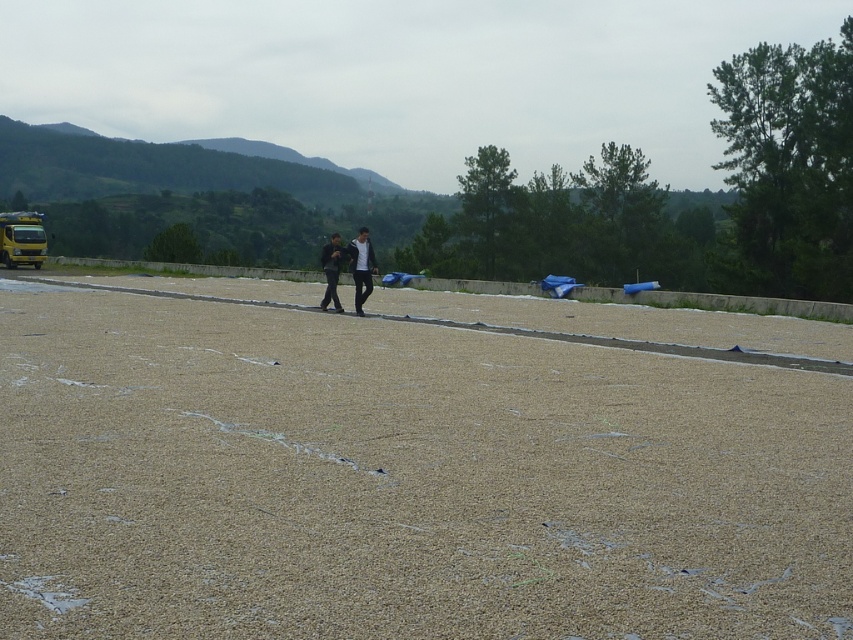
Question: Can you confirm if dark gray fabric at center is bigger than yellow metallic school bus at left?

Choices:
 (A) no
 (B) yes

Answer: (B)

Question: Which point is farther from the camera taking this photo?

Choices:
 (A) (347, 372)
 (B) (331, 266)
 (C) (335, 260)

Answer: (B)

Question: Is brown gravel at center further to the viewer compared to dark gray fabric at center?

Choices:
 (A) yes
 (B) no

Answer: (B)

Question: Can you confirm if brown gravel at center is bigger than black matte jacket at center?

Choices:
 (A) yes
 (B) no

Answer: (B)

Question: Which of the following is the farthest from the observer?

Choices:
 (A) brown gravel at center
 (B) dark gray fabric at center
 (C) yellow metallic school bus at left

Answer: (C)

Question: Which of the following is the farthest from the observer?

Choices:
 (A) brown gravel at center
 (B) yellow metallic school bus at left

Answer: (B)